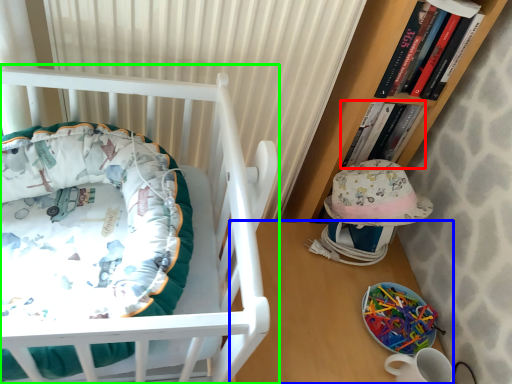
Question: Estimate the real-world distances between objects in this image. Which object is farther from book (highlighted by a red box), table (highlighted by a blue box) or infant bed (highlighted by a green box)?

Choices:
 (A) table
 (B) infant bed

Answer: (B)